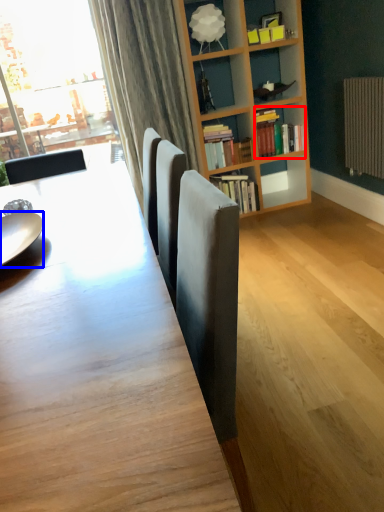
Question: Which point is further to the camera, book (highlighted by a red box) or plate (highlighted by a blue box)?

Choices:
 (A) book
 (B) plate

Answer: (A)